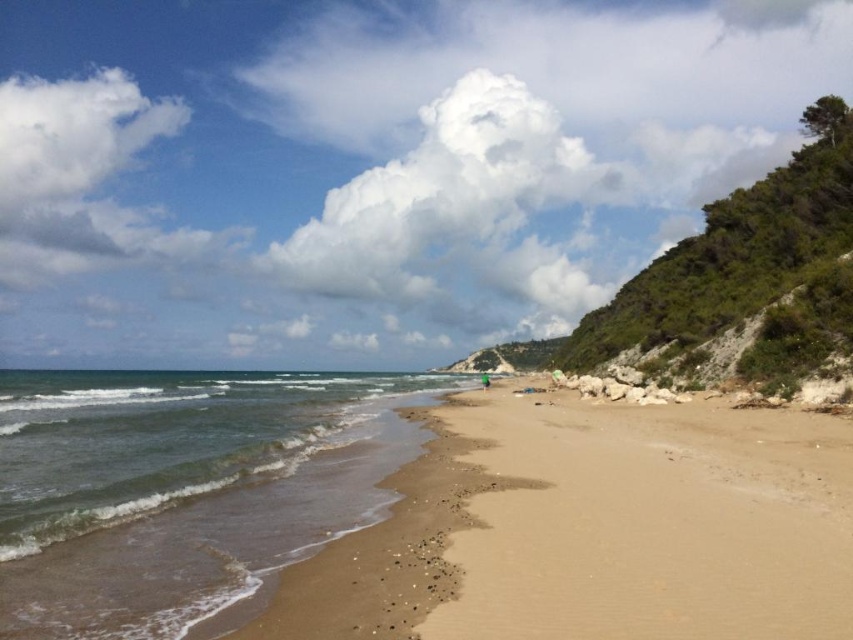
Looking at this image, does greenish-blue water at lower left appear on the right side of green fabric person at center?

Incorrect, greenish-blue water at lower left is not on the right side of green fabric person at center.

Does greenish-blue water at lower left appear under green fabric person at center?

No, greenish-blue water at lower left is not below green fabric person at center.

Who is more distant from viewer, (144, 440) or (486, 380)?

Positioned behind is point (486, 380).

Identify the location of greenish-blue water at lower left. Image resolution: width=853 pixels, height=640 pixels. (181, 486).

Is light brown sand at center bigger than green fabric person at center?

Incorrect, light brown sand at center is not larger than green fabric person at center.

Does light brown sand at center have a greater height compared to green fabric person at center?

No, light brown sand at center is not taller than green fabric person at center.

Which is in front, point (788, 611) or point (486, 381)?

Point (788, 611) is in front.

This screenshot has height=640, width=853. In order to click on light brown sand at center in this screenshot , I will do `click(653, 522)`.

Looking at this image, can you confirm if greenish-blue water at lower left is positioned to the left of light brown sand at center?

Correct, you'll find greenish-blue water at lower left to the left of light brown sand at center.

Based on the photo, which is more to the left, greenish-blue water at lower left or light brown sand at center?

greenish-blue water at lower left is more to the left.

Is point (339, 499) positioned behind point (753, 499)?

That is True.

Locate an element on the screen. Image resolution: width=853 pixels, height=640 pixels. greenish-blue water at lower left is located at coordinates (181, 486).